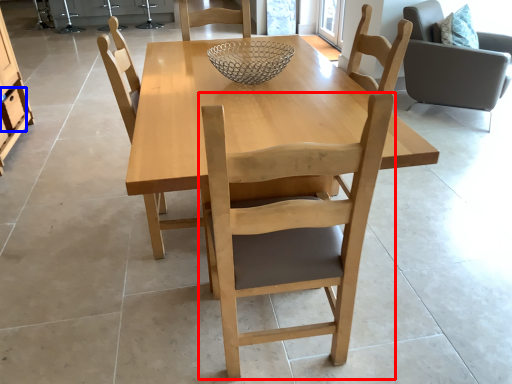
Question: Which of the following is the farthest to the observer, chair (highlighted by a red box) or drawer (highlighted by a blue box)?

Choices:
 (A) chair
 (B) drawer

Answer: (B)